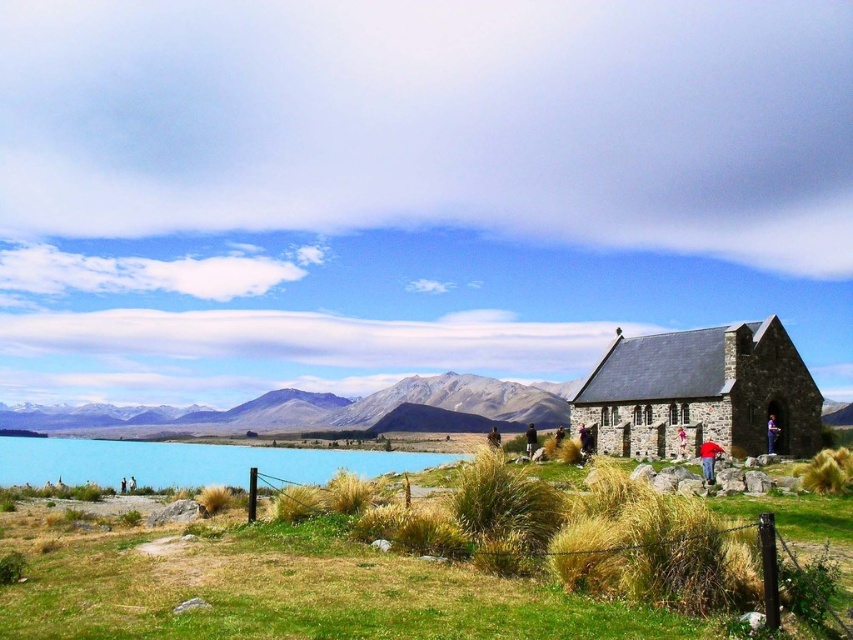
The image size is (853, 640). I want to click on white snow-covered mountain at center, so click(321, 406).

Which is behind, point (399, 636) or point (53, 467)?

The point (53, 467) is behind.

Does dry grass at center have a lesser height compared to blue glassy lake at lower left?

No, dry grass at center is not shorter than blue glassy lake at lower left.

Who is more distant from viewer, (45, 452) or (384, 470)?

Point (45, 452)

At what (x,y) coordinates should I click in order to perform the action: click on dry grass at center. Please return your answer as a coordinate pair (x, y). Looking at the image, I should click on (288, 589).

I want to click on dry grass at center, so click(288, 589).

Based on the photo, can you confirm if dry grass at center is thinner than stone church at right?

No.

Does point (79, 474) come behind point (776, 342)?

Yes.

In order to click on dry grass at center in this screenshot , I will do [288, 589].